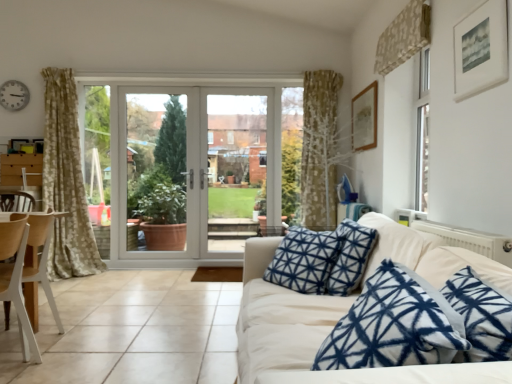
Find the location of a particular element. This screenshot has width=512, height=384. unoccupied region to the right of white wood chair at left is located at coordinates (79, 346).